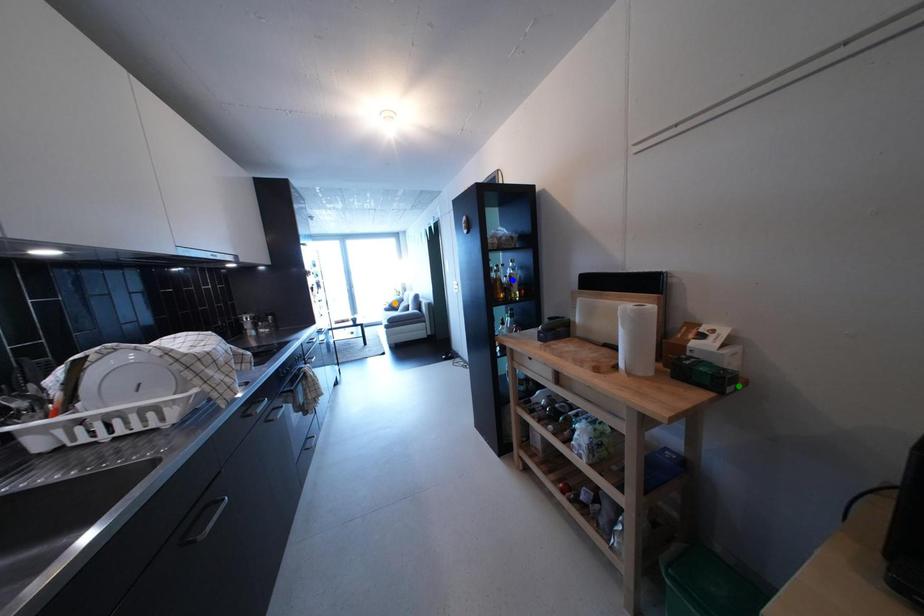
Order these from nearest to farthest:
1. blue point
2. orange point
3. green point

1. orange point
2. blue point
3. green point